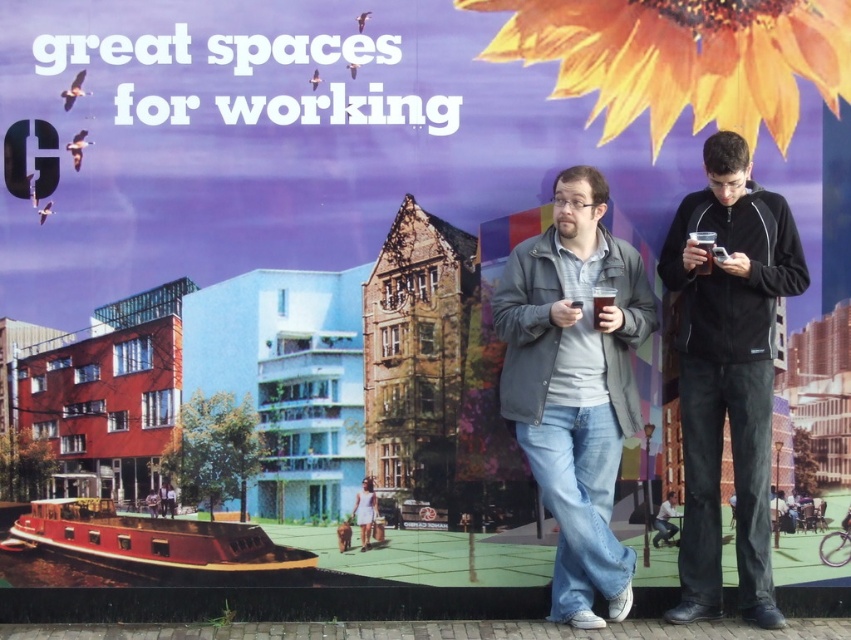
You are standing in front of the mural and want to take a photo of the matte gray jacket at center. What coordinates should you aim your camera at to capture it perfectly?

You should aim your camera at the coordinates point (575, 385) to capture the matte gray jacket at center.

Based on the photo, you are standing in front of the mural and want to know how far you are from the point marked at coordinates (694,524). Can you determine the distance?

The point marked at coordinates (694,524) is 7.96 meters away from the viewer.

You are standing in front of the mural and notice a point marked at coordinates (727, 371). Based on the scene description, what object is located at that point?

→ The point at (727, 371) marks the location of the black smooth jacket at right.